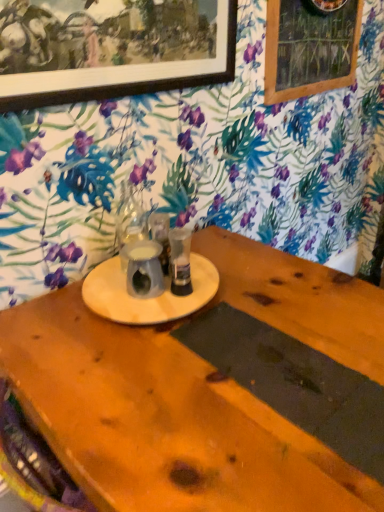
At what (x,y) coordinates should I click in order to perform the action: click on vacant space in front of translucent glass vase at center, placed as the 1th tableware when sorted from left to right. Please return your answer as a coordinate pair (x, y). Looking at the image, I should click on (129, 302).